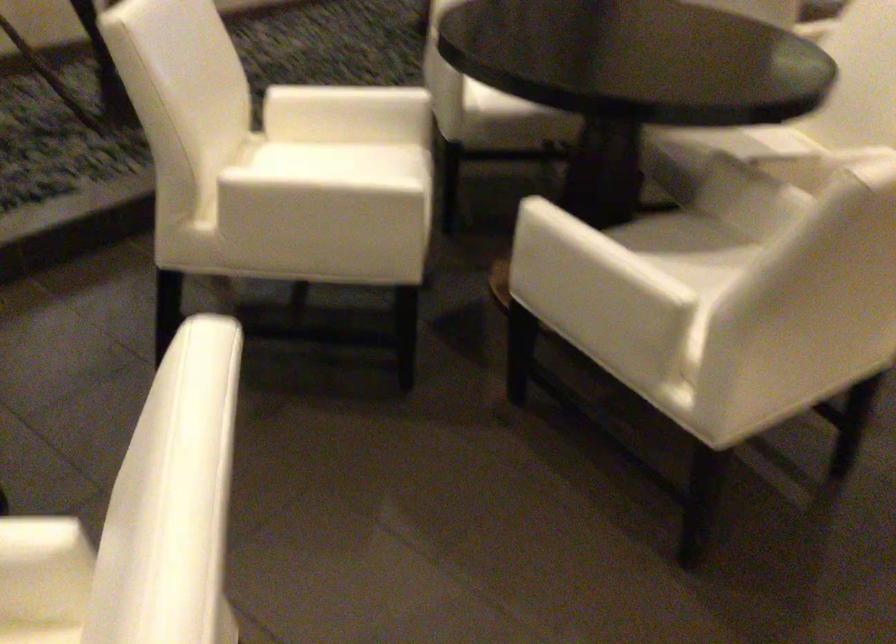
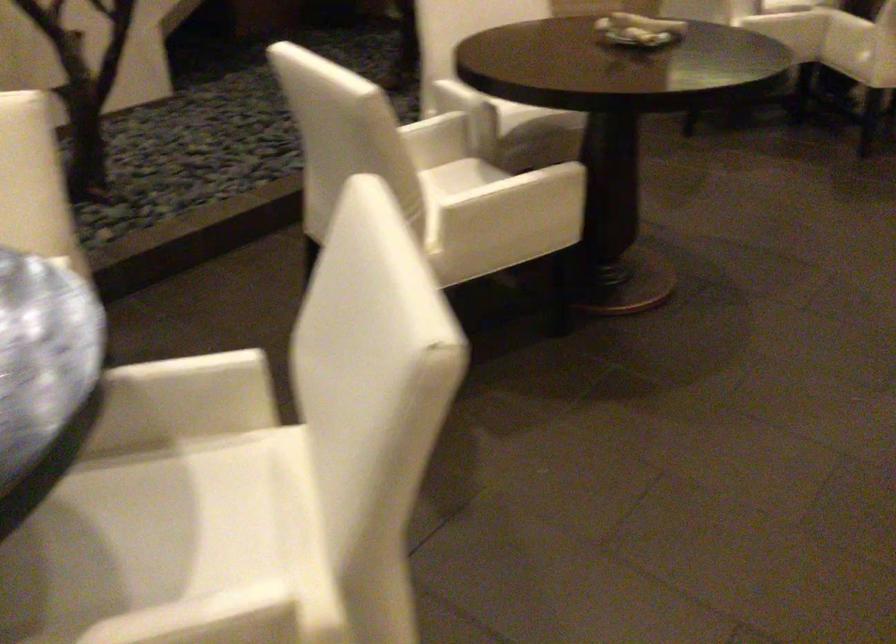
The point at (767,138) is marked in the first image. Where is the corresponding point in the second image?

(177, 514)